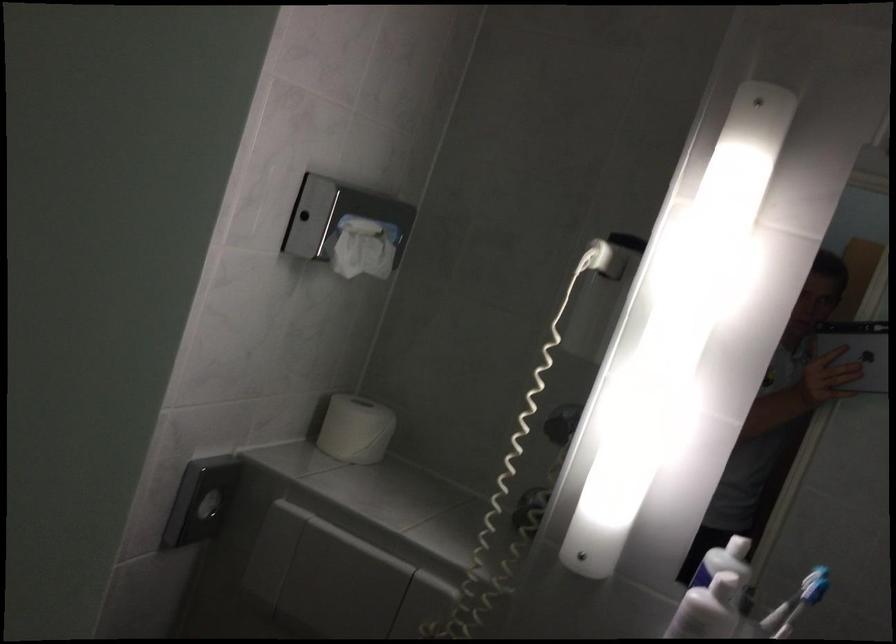
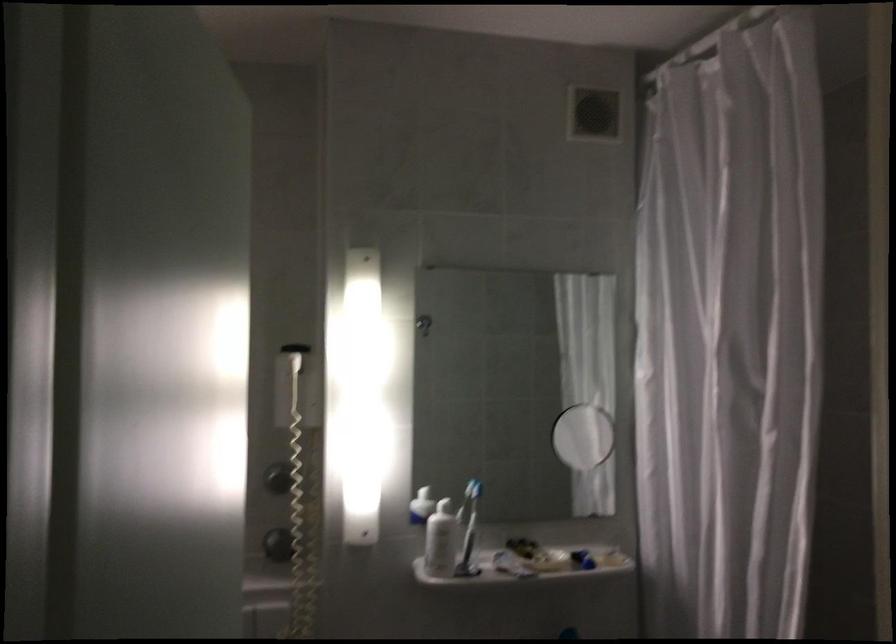
Question: I am providing you with two images of the same scene from different viewpoints. Please identify which objects are invisible in image2.

Choices:
 (A) white toilet paper roll
 (B) blue toothbrush
 (C) purple hair dryer
 (D) dispenser pump head

Answer: (A)